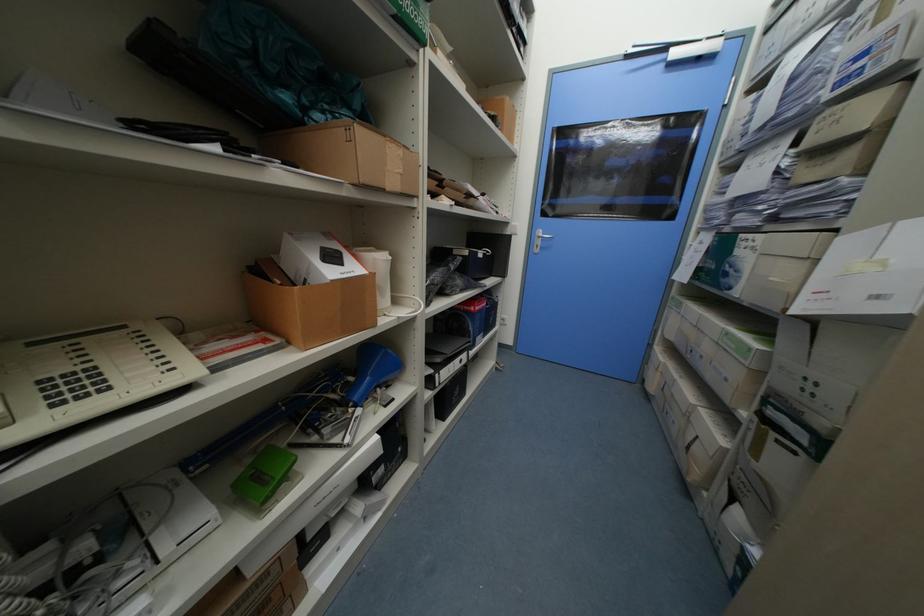
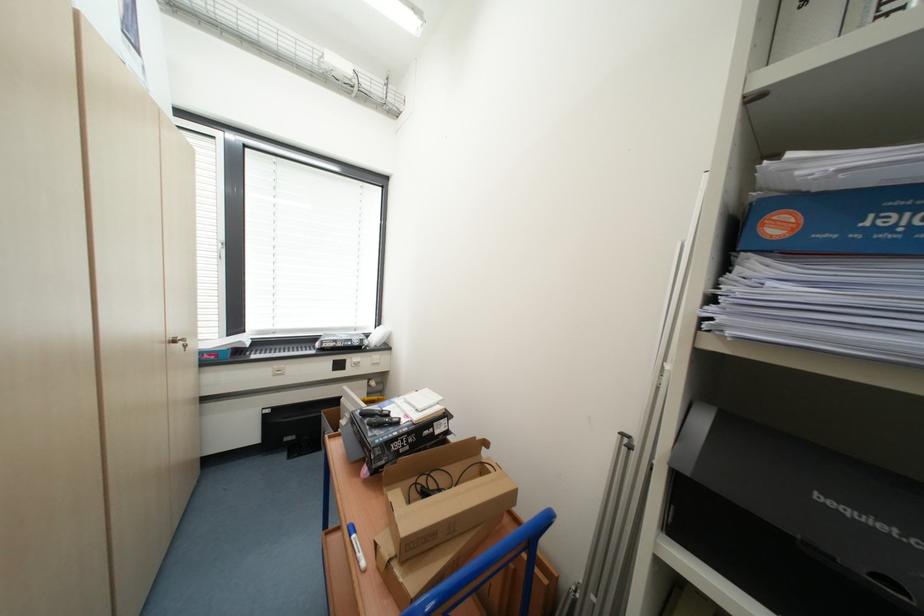
Question: How did the camera likely rotate?

Choices:
 (A) Left
 (B) Right
 (C) Up
 (D) Down

Answer: (A)